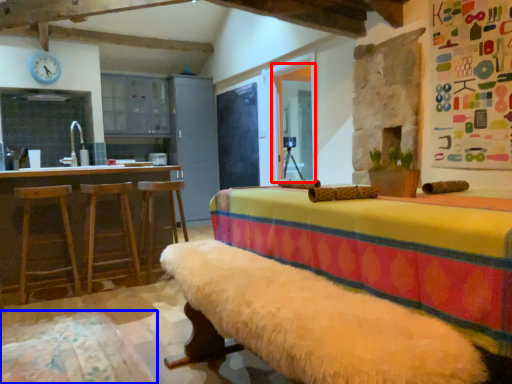
Question: Which point is further to the camera, window screen (highlighted by a red box) or bedding (highlighted by a blue box)?

Choices:
 (A) window screen
 (B) bedding

Answer: (A)